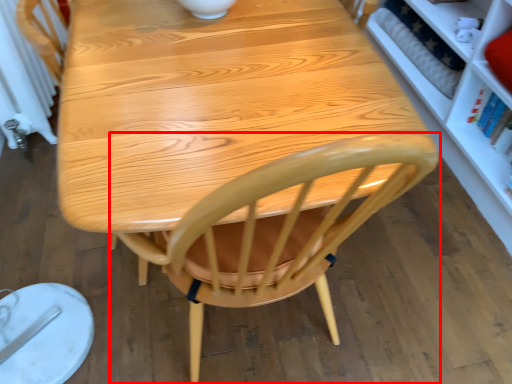
Question: From the image's perspective, what is the correct spatial positioning of chair (annotated by the red box) in reference to radiator?

Choices:
 (A) above
 (B) below

Answer: (B)